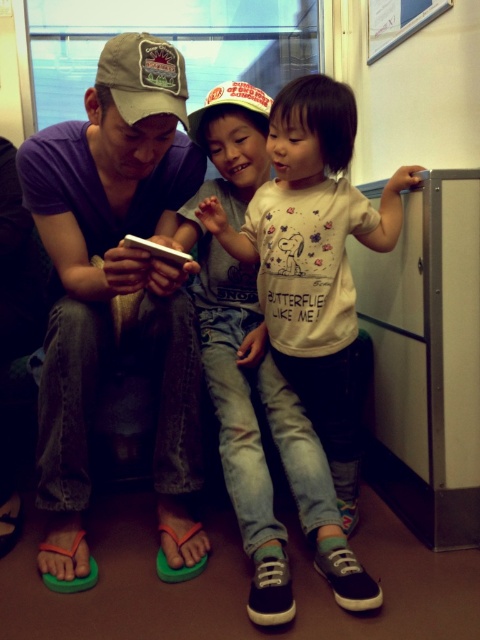
Between green flip-flops at lower left and white matte baseball cap at center, which one is positioned lower?

green flip-flops at lower left is lower down.

Does green flip-flops at lower left appear on the left side of white matte baseball cap at center?

Correct, you'll find green flip-flops at lower left to the left of white matte baseball cap at center.

Measure the distance between point (72, 532) and camera.

Point (72, 532) and camera are 4.77 feet apart.

I want to click on green flip-flops at lower left, so click(115, 288).

Is white cotton shirt at center further to camera compared to white matte baseball cap at center?

That is False.

Does white cotton shirt at center have a greater height compared to white matte baseball cap at center?

Correct, white cotton shirt at center is much taller as white matte baseball cap at center.

Between point (305, 371) and point (212, 97), which one is positioned behind?

Positioned behind is point (212, 97).

The height and width of the screenshot is (640, 480). Find the location of `white cotton shirt at center`. white cotton shirt at center is located at coordinates (313, 257).

Does white cotton shirt at center lie in front of beige fabric baseball cap at upper left?

No.

Between white cotton shirt at center and beige fabric baseball cap at upper left, which one appears on the left side from the viewer's perspective?

From the viewer's perspective, beige fabric baseball cap at upper left appears more on the left side.

Does point (337, 188) come closer to viewer compared to point (149, 49)?

No, (337, 188) is further to viewer.

Where is `white cotton shirt at center`? This screenshot has width=480, height=640. white cotton shirt at center is located at coordinates (313, 257).